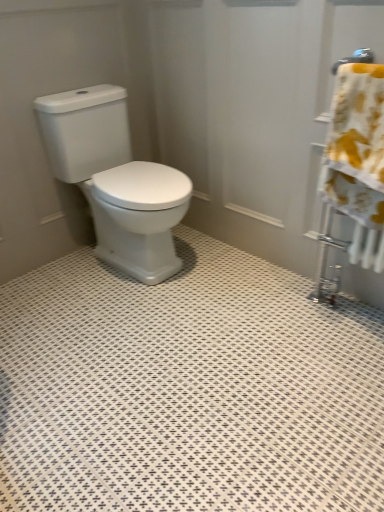
Question: Is white glossy toilet at center taller or shorter than yellow floral fabric at right?

Choices:
 (A) short
 (B) tall

Answer: (B)

Question: From a real-world perspective, is white glossy toilet at center physically located above or below yellow floral fabric at right?

Choices:
 (A) above
 (B) below

Answer: (B)

Question: From the image's perspective, is white glossy toilet at center located above or below yellow floral fabric at right?

Choices:
 (A) below
 (B) above

Answer: (B)

Question: Is yellow floral fabric at right to the left or to the right of white glossy toilet at center in the image?

Choices:
 (A) left
 (B) right

Answer: (B)

Question: Is yellow floral fabric at right taller or shorter than white glossy toilet at center?

Choices:
 (A) short
 (B) tall

Answer: (A)

Question: Does point (354, 102) appear closer or farther from the camera than point (168, 209)?

Choices:
 (A) farther
 (B) closer

Answer: (B)

Question: Is yellow floral fabric at right in front of or behind white glossy toilet at center in the image?

Choices:
 (A) front
 (B) behind

Answer: (A)